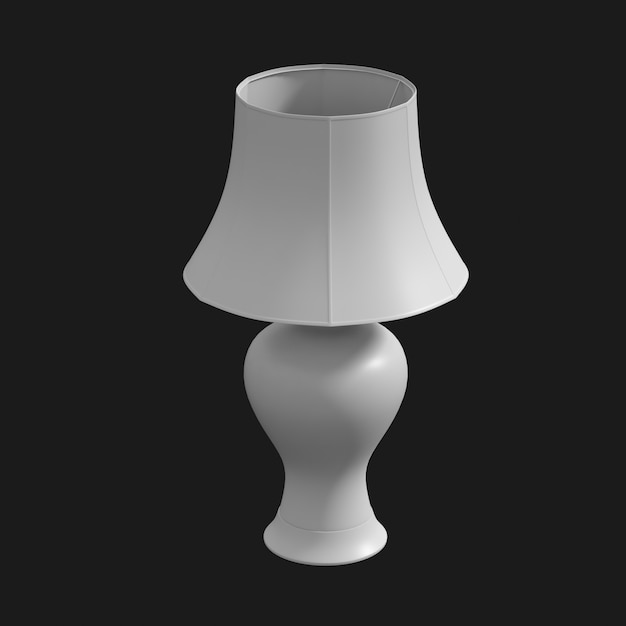
Identify the location of inside of lamp shade. (336, 104).